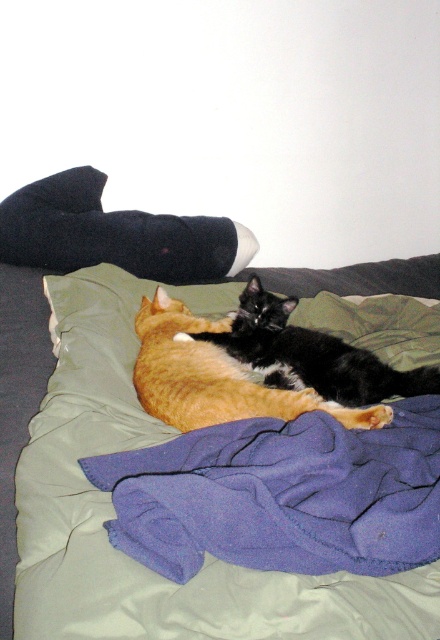
You are standing at the foot of the bed and want to reach the point at the bottom right corner of the bed. Which point, point (252, 579) or point (410, 372), is closer to your current position?

Point (252, 579) is closer to your current position because it is in front of point (410, 372).

You are trying to find the purple fleece blanket at center in the image. Which direction should you look relative to the soft green blanket at center?

The purple fleece blanket at center is to the right of the soft green blanket at center.

You are a photographer trying to capture a closeup shot of the black fur cat at center. You notice the soft green blanket at center is partially covering the cat. Can you adjust your position to get a clear view of the cat without moving the blanket?

The soft green blanket at center is bigger than the black fur cat at center, so it might be covering part of the cat. To get a clear view, you can move your camera position slightly to the side where the cat is not covered by the blanket.